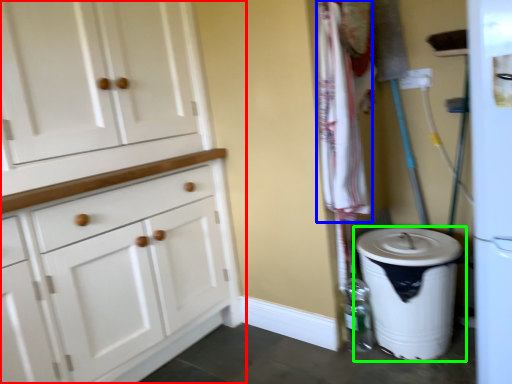
Question: Which object is the farthest from cabinetry (highlighted by a red box)? Choose among these: laundry (highlighted by a blue box) or waste container (highlighted by a green box).

Choices:
 (A) laundry
 (B) waste container

Answer: (B)